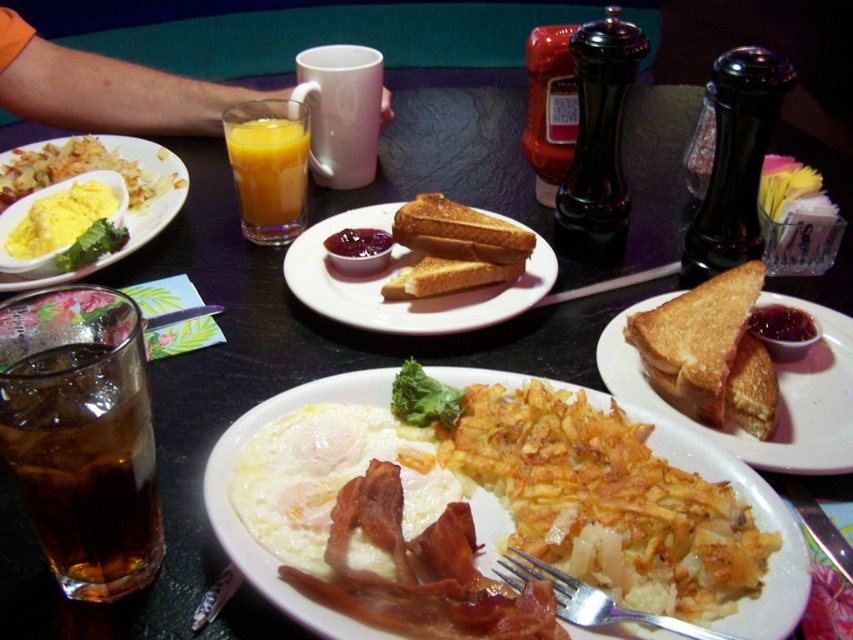
Describe the element at coordinates (329, 476) in the screenshot. I see `white fried egg at center` at that location.

Does white fried egg at center appear over slightly toasted bread at center?

No, white fried egg at center is not above slightly toasted bread at center.

Is point (305, 536) less distant than point (834, 380)?

That is True.

Identify the location of white fried egg at center. (329, 476).

Is slightly toasted bread at center behind matte yellow eggs at center?

No.

Between slightly toasted bread at center and matte yellow eggs at center, which one is positioned lower?

slightly toasted bread at center is lower down.

Which is in front, point (619, 353) or point (15, 156)?

Point (619, 353) is in front.

Identify the location of slightly toasted bread at center. point(779,394).

Between point (294, 563) and point (78, 221), which one is positioned in front?

Positioned in front is point (294, 563).

Which is behind, point (311, 512) or point (10, 228)?

The point (10, 228) is more distant.

Image resolution: width=853 pixels, height=640 pixels. I want to click on white fried egg at center, so click(329, 476).